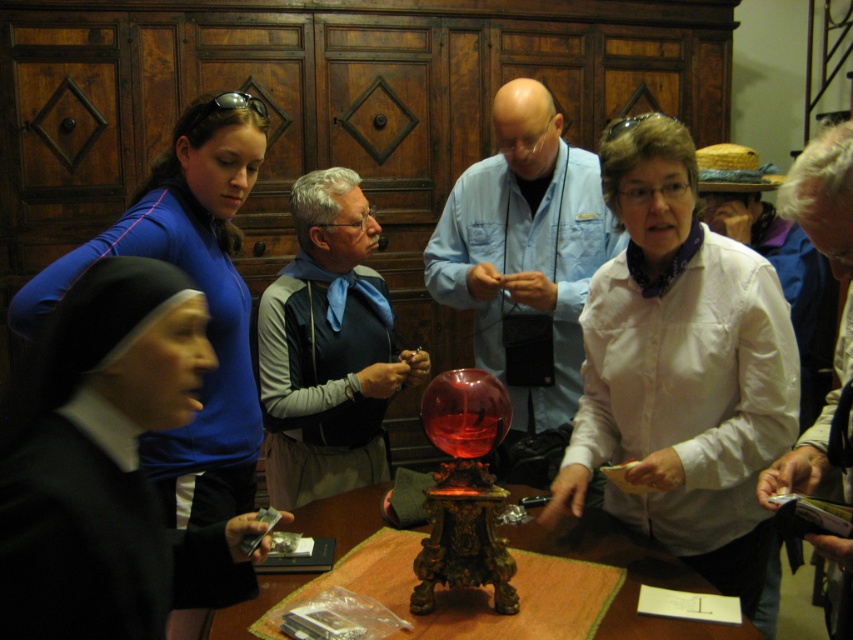
In the scene shown: You are a photographer trying to capture a group photo of the white satin blouse at center and the matte blue shirt at center. The camera you are using has a minimum focusing distance of 70 centimeters. Will you be able to take a clear photo of both subjects at the same time?

The white satin blouse at center and the matte blue shirt at center are 73.46 centimeters apart. Since the minimum focusing distance is 70 centimeters, the camera can focus on both subjects simultaneously as the distance between them is within the required range.

You are an observer standing in front of the table. You see the white satin blouse at center and the white paper at right. Which object is taller?

The white satin blouse at center is taller than the white paper at right.